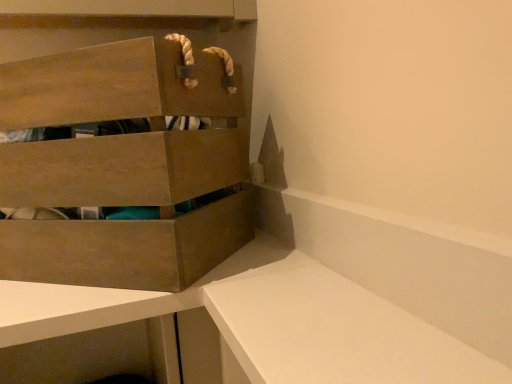
The image size is (512, 384). Describe the element at coordinates (124, 145) in the screenshot. I see `wooden crate at upper left` at that location.

Locate an element on the screen. This screenshot has height=384, width=512. wooden crate at upper left is located at coordinates (124, 145).

What do you see at coordinates (331, 329) in the screenshot? I see `white matte vanity at lower right` at bounding box center [331, 329].

This screenshot has width=512, height=384. What are the coordinates of `white matte vanity at lower right` in the screenshot? It's located at (331, 329).

Identify the location of wooden crate at upper left. (124, 145).

Considering the relative positions of wooden crate at upper left and white matte vanity at lower right in the image provided, is wooden crate at upper left to the left or to the right of white matte vanity at lower right?

From the image, it's evident that wooden crate at upper left is to the left of white matte vanity at lower right.

In the scene shown: Is the position of wooden crate at upper left less distant than that of white matte vanity at lower right?

No, it is not.

Which is closer, (225, 157) or (506, 382)?

The point (506, 382) is in front.

From the image's perspective, which one is positioned higher, wooden crate at upper left or white matte vanity at lower right?

wooden crate at upper left is shown above in the image.

From a real-world perspective, who is located higher, wooden crate at upper left or white matte vanity at lower right?

wooden crate at upper left, from a real-world perspective.

Is wooden crate at upper left wider or thinner than white matte vanity at lower right?

Clearly, wooden crate at upper left has more width compared to white matte vanity at lower right.

Who is taller, wooden crate at upper left or white matte vanity at lower right?

wooden crate at upper left is taller.

Considering the sizes of objects wooden crate at upper left and white matte vanity at lower right in the image provided, who is smaller, wooden crate at upper left or white matte vanity at lower right?

With smaller size is white matte vanity at lower right.

Looking at this image, is white matte vanity at lower right located within wooden crate at upper left?

No.

Can you see wooden crate at upper left touching white matte vanity at lower right?

They are not placed beside each other.

Looking at this image, is wooden crate at upper left facing towards white matte vanity at lower right?

No, wooden crate at upper left is not facing towards white matte vanity at lower right.

Identify the location of cabinetry behind the white matte vanity at lower right. (124, 145).

Which object is positioned more to the right, white matte vanity at lower right or wooden crate at upper left?

From the viewer's perspective, white matte vanity at lower right appears more on the right side.

Is white matte vanity at lower right in front of wooden crate at upper left?

Yes, the depth of white matte vanity at lower right is less than that of wooden crate at upper left.

Which point is more forward, (297, 334) or (49, 253)?

The point (297, 334) is closer.

From the image's perspective, which is above, white matte vanity at lower right or wooden crate at upper left?

wooden crate at upper left.

From a real-world perspective, is white matte vanity at lower right located higher than wooden crate at upper left?

Incorrect, from a real-world perspective, white matte vanity at lower right is lower than wooden crate at upper left.

In terms of width, does white matte vanity at lower right look wider or thinner when compared to wooden crate at upper left?

white matte vanity at lower right is thinner than wooden crate at upper left.

Can you confirm if white matte vanity at lower right is taller than wooden crate at upper left?

Incorrect, the height of white matte vanity at lower right is not larger of that of wooden crate at upper left.

In terms of size, does white matte vanity at lower right appear bigger or smaller than wooden crate at upper left?

Considering their sizes, white matte vanity at lower right takes up less space than wooden crate at upper left.

Is white matte vanity at lower right outside of wooden crate at upper left?

That's correct, white matte vanity at lower right is outside of wooden crate at upper left.

Is white matte vanity at lower right with wooden crate at upper left?

There is a gap between white matte vanity at lower right and wooden crate at upper left.

Is white matte vanity at lower right facing towards wooden crate at upper left?

Yes.

Locate an element on the screen. cabinetry above the white matte vanity at lower right (from the image's perspective) is located at coordinates (124, 145).

This screenshot has width=512, height=384. I want to click on vanity lying in front of the wooden crate at upper left, so click(x=331, y=329).

Identify the location of vanity to the right of wooden crate at upper left. (331, 329).